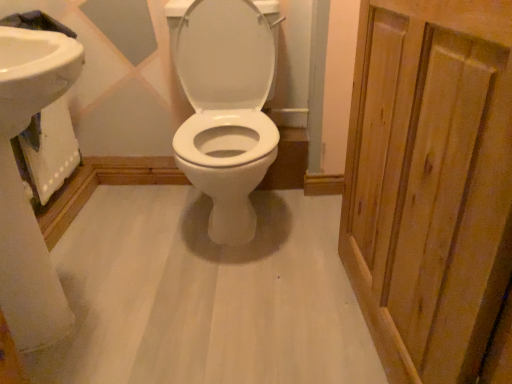
Question: Is natural wood screen door at right not near white glossy toilet at center?

Choices:
 (A) no
 (B) yes

Answer: (A)

Question: Is natural wood screen door at right oriented towards white glossy toilet at center?

Choices:
 (A) yes
 (B) no

Answer: (B)

Question: From a real-world perspective, does natural wood screen door at right sit lower than white glossy toilet at center?

Choices:
 (A) no
 (B) yes

Answer: (A)

Question: Is white glossy toilet at center at the back of natural wood screen door at right?

Choices:
 (A) no
 (B) yes

Answer: (A)

Question: From the image's perspective, would you say natural wood screen door at right is shown under white glossy toilet at center?

Choices:
 (A) yes
 (B) no

Answer: (A)

Question: Is white glossy sink at left taller or shorter than white glossy toilet at center?

Choices:
 (A) tall
 (B) short

Answer: (B)

Question: From the image's perspective, is white glossy sink at left located above or below white glossy toilet at center?

Choices:
 (A) below
 (B) above

Answer: (A)

Question: Is white glossy sink at left in front of or behind white glossy toilet at center in the image?

Choices:
 (A) behind
 (B) front

Answer: (B)

Question: Looking at the image, does white glossy sink at left seem bigger or smaller compared to white glossy toilet at center?

Choices:
 (A) big
 (B) small

Answer: (B)

Question: Is white glossy sink at left taller or shorter than natural wood screen door at right?

Choices:
 (A) short
 (B) tall

Answer: (A)

Question: Considering the positions of white glossy sink at left and natural wood screen door at right in the image, is white glossy sink at left bigger or smaller than natural wood screen door at right?

Choices:
 (A) big
 (B) small

Answer: (A)

Question: Considering the relative positions of white glossy sink at left and natural wood screen door at right in the image provided, is white glossy sink at left to the left or to the right of natural wood screen door at right?

Choices:
 (A) left
 (B) right

Answer: (A)

Question: From the image's perspective, is white glossy sink at left positioned above or below natural wood screen door at right?

Choices:
 (A) below
 (B) above

Answer: (A)

Question: Considering the positions of white glossy toilet at center and white glossy sink at left in the image, is white glossy toilet at center wider or thinner than white glossy sink at left?

Choices:
 (A) wide
 (B) thin

Answer: (A)

Question: In terms of size, does white glossy toilet at center appear bigger or smaller than white glossy sink at left?

Choices:
 (A) small
 (B) big

Answer: (B)